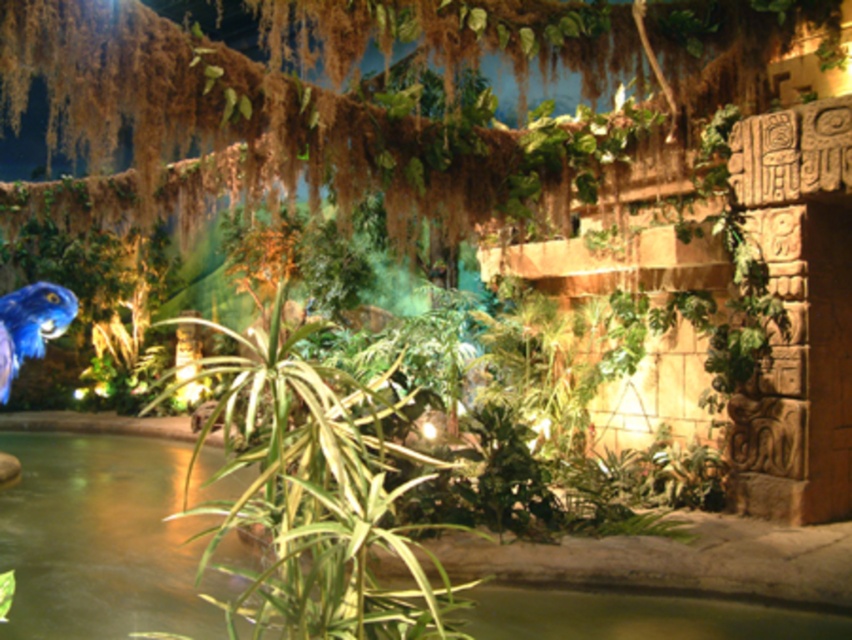
Does green leafy pond at center have a larger size compared to green leafy plant at center?

Indeed, green leafy pond at center has a larger size compared to green leafy plant at center.

Which is above, green leafy pond at center or green leafy plant at center?

Positioned higher is green leafy plant at center.

Image resolution: width=852 pixels, height=640 pixels. Identify the location of green leafy pond at center. (102, 540).

The image size is (852, 640). In order to click on green leafy pond at center in this screenshot , I will do `click(102, 540)`.